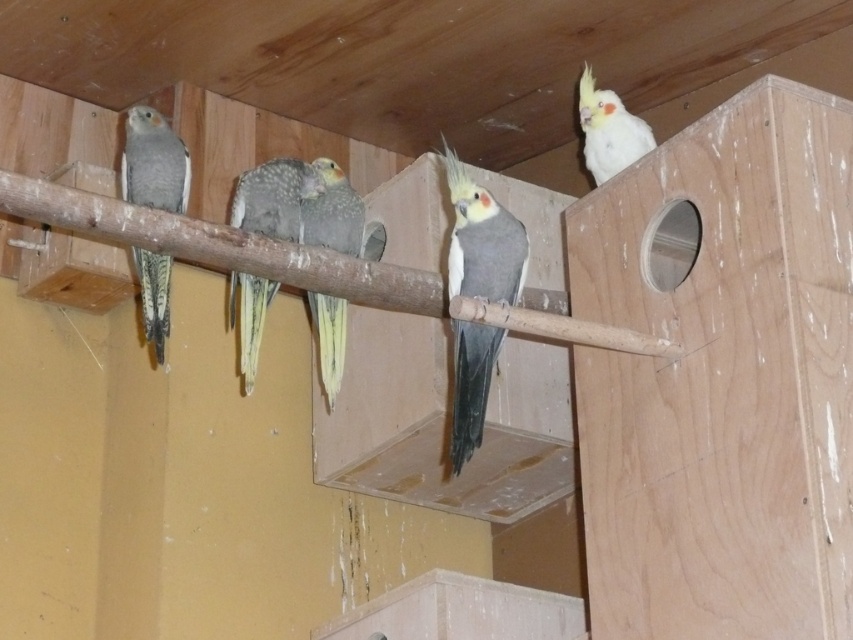
Measure the distance between gray matte parrot at center and gray matte parrot at left.

They are 20.58 inches apart.

Is point (474, 340) closer to camera compared to point (184, 186)?

Yes, point (474, 340) is closer to viewer.

Where is `gray matte parrot at center`? This screenshot has height=640, width=853. gray matte parrot at center is located at coordinates (482, 241).

Is gray matte parrot at center further to the viewer compared to speckled feathered parrot at center?

No.

Who is positioned more to the right, gray matte parrot at center or speckled feathered parrot at center?

From the viewer's perspective, gray matte parrot at center appears more on the right side.

Is point (457, 369) farther from viewer compared to point (289, 172)?

No, it is not.

Locate an element on the screen. The image size is (853, 640). gray matte parrot at center is located at coordinates (482, 241).

Does speckled feathered parrot at center appear under white matte parrot at upper right?

Indeed, speckled feathered parrot at center is positioned under white matte parrot at upper right.

Between speckled feathered parrot at center and white matte parrot at upper right, which one is positioned lower?

speckled feathered parrot at center is lower down.

Which is behind, point (274, 200) or point (614, 113)?

The point (614, 113) is behind.

This screenshot has height=640, width=853. Identify the location of speckled feathered parrot at center. (274, 196).